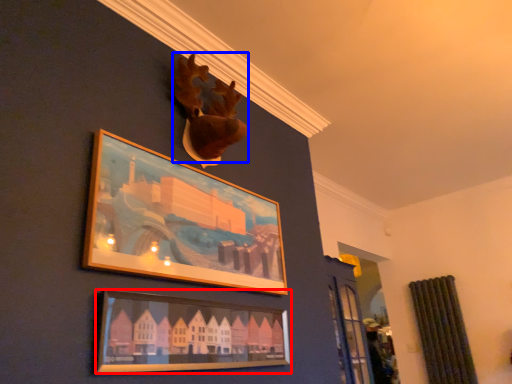
Question: Among these objects, which one is nearest to the camera, picture frame (highlighted by a red box) or animal (highlighted by a blue box)?

Choices:
 (A) picture frame
 (B) animal

Answer: (A)